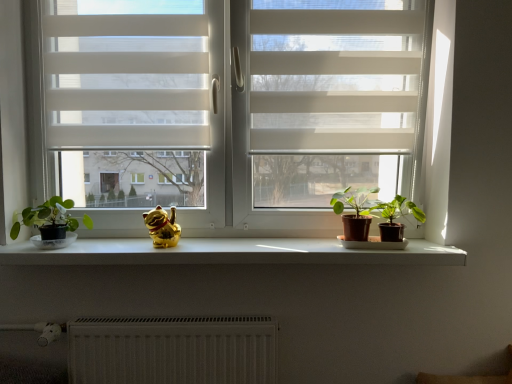
Where is `free area in between gold shiny cat at center and green matte plant at center, which is counted as the second houseplant, starting from the left`? Image resolution: width=512 pixels, height=384 pixels. free area in between gold shiny cat at center and green matte plant at center, which is counted as the second houseplant, starting from the left is located at coordinates (256, 246).